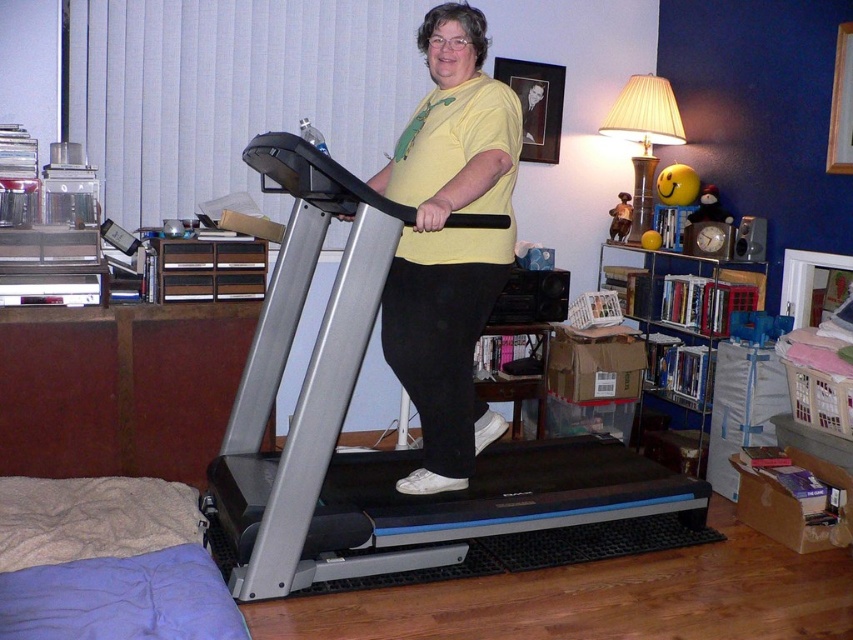
Can you confirm if silver metallic treadmill at center is positioned to the left of metallic silver bookshelf at right?

Yes, silver metallic treadmill at center is to the left of metallic silver bookshelf at right.

Can you confirm if silver metallic treadmill at center is wider than metallic silver bookshelf at right?

Yes, silver metallic treadmill at center is wider than metallic silver bookshelf at right.

Between point (340, 454) and point (699, 317), which one is positioned in front?

Point (340, 454) is more forward.

Where is `silver metallic treadmill at center`? silver metallic treadmill at center is located at coordinates (379, 451).

The width and height of the screenshot is (853, 640). What do you see at coordinates (448, 243) in the screenshot?
I see `yellow matte shirt at center` at bounding box center [448, 243].

Is yellow matte shirt at center in front of metallic silver bookshelf at right?

Yes, yellow matte shirt at center is in front of metallic silver bookshelf at right.

Image resolution: width=853 pixels, height=640 pixels. What do you see at coordinates (448, 243) in the screenshot?
I see `yellow matte shirt at center` at bounding box center [448, 243].

This screenshot has height=640, width=853. Identify the location of yellow matte shirt at center. (448, 243).

Can you confirm if silver metallic treadmill at center is taller than yellow matte shirt at center?

No.

Looking at this image, which of these two, silver metallic treadmill at center or yellow matte shirt at center, stands taller?

yellow matte shirt at center is taller.

Where is `silver metallic treadmill at center`? This screenshot has height=640, width=853. silver metallic treadmill at center is located at coordinates (379, 451).